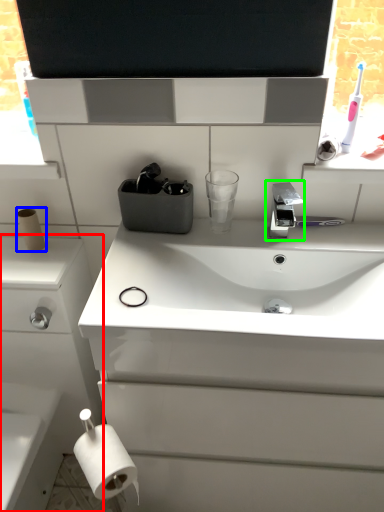
Question: Considering the real-world distances, which object is farthest from bathroom cabinet (highlighted by a red box)? toilet paper (highlighted by a blue box) or tap (highlighted by a green box)?

Choices:
 (A) toilet paper
 (B) tap

Answer: (B)